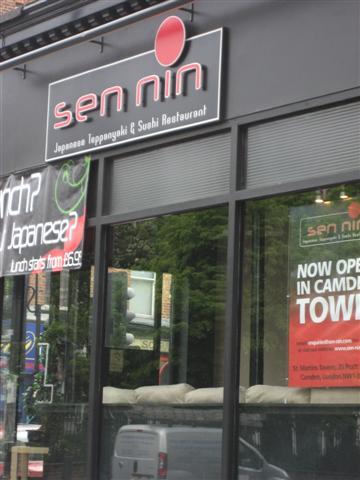
Where is `blinds`? The width and height of the screenshot is (360, 480). blinds is located at coordinates (184, 159), (294, 152), (92, 185).